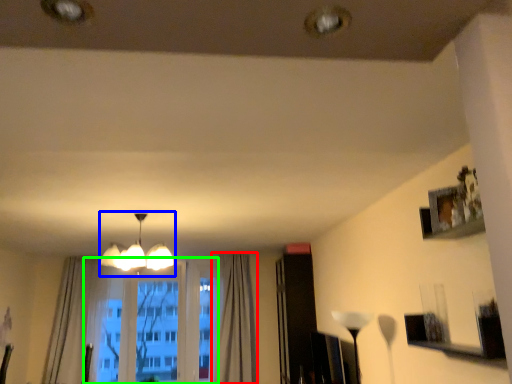
Question: Estimate the real-world distances between objects in this image. Which object is closer to curtain (highlighted by a red box), lamp (highlighted by a blue box) or bay window (highlighted by a green box)?

Choices:
 (A) lamp
 (B) bay window

Answer: (B)